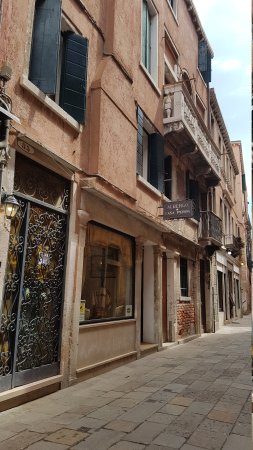
Find the location of a particular element. shutters is located at coordinates (139, 148).